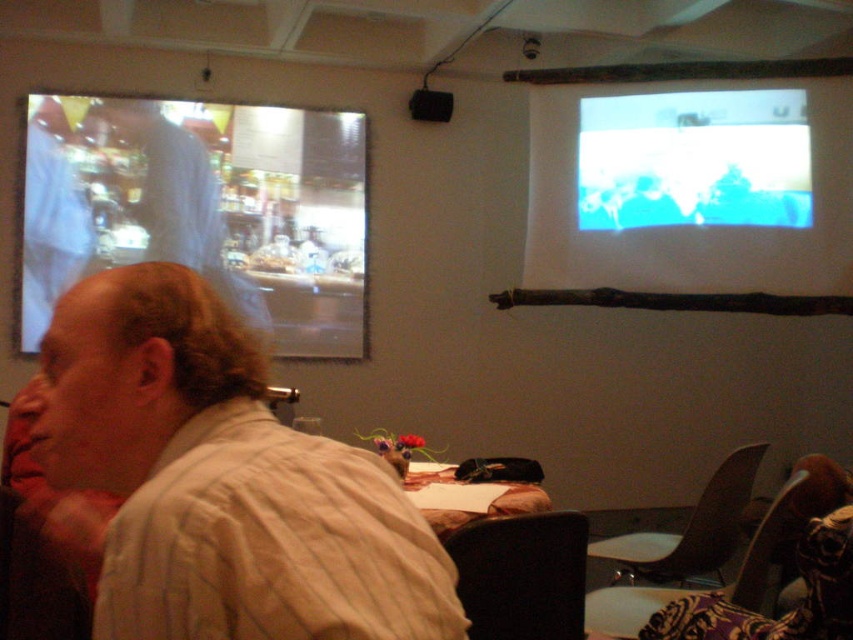
Is white striped shirt at left to the left of wooden table at center from the viewer's perspective?

Indeed, white striped shirt at left is positioned on the left side of wooden table at center.

Does point (119, 312) come in front of point (515, 504)?

That is True.

Find the location of `white striped shirt at left`. white striped shirt at left is located at coordinates (222, 481).

Can you confirm if matte glass display at upper left is positioned below wooden table at center?

Incorrect, matte glass display at upper left is not positioned below wooden table at center.

Who is more distant from viewer, (326,211) or (440,531)?

Point (326,211)

Identify the location of matte glass display at upper left. This screenshot has width=853, height=640. [202, 209].

Which is below, white striped shirt at left or matte glass display at upper left?

white striped shirt at left

How far apart are white striped shirt at left and matte glass display at upper left?

white striped shirt at left and matte glass display at upper left are 4.00 meters apart from each other.

Identify the location of white striped shirt at left. (222, 481).

Identify the location of white striped shirt at left. (222, 481).